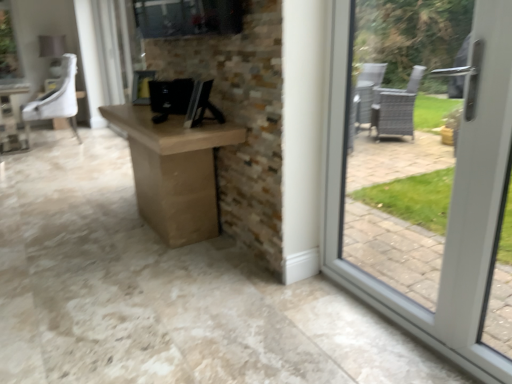
Question: Would you say black glossy desktop computer at center contains white leather chair at upper left?

Choices:
 (A) no
 (B) yes

Answer: (A)

Question: From a real-world perspective, does black glossy desktop computer at center sit lower than white leather chair at upper left?

Choices:
 (A) yes
 (B) no

Answer: (B)

Question: Is black glossy desktop computer at center behind white leather chair at upper left?

Choices:
 (A) yes
 (B) no

Answer: (B)

Question: Is black glossy desktop computer at center positioned far away from white leather chair at upper left?

Choices:
 (A) yes
 (B) no

Answer: (A)

Question: Is black glossy desktop computer at center wider than white leather chair at upper left?

Choices:
 (A) no
 (B) yes

Answer: (A)

Question: From the image's perspective, is white leather chair at upper left positioned above or below brown cardboard box at center?

Choices:
 (A) below
 (B) above

Answer: (B)

Question: Is white leather chair at upper left inside the boundaries of brown cardboard box at center, or outside?

Choices:
 (A) outside
 (B) inside

Answer: (A)

Question: Is white leather chair at upper left taller or shorter than brown cardboard box at center?

Choices:
 (A) tall
 (B) short

Answer: (A)

Question: Relative to brown cardboard box at center, is white leather chair at upper left in front or behind?

Choices:
 (A) behind
 (B) front

Answer: (A)

Question: From a real-world perspective, is black glossy desktop computer at center positioned above or below white leather chair at upper left?

Choices:
 (A) below
 (B) above

Answer: (B)

Question: Is black glossy desktop computer at center taller or shorter than white leather chair at upper left?

Choices:
 (A) short
 (B) tall

Answer: (A)

Question: In the image, is black glossy desktop computer at center positioned in front of or behind white leather chair at upper left?

Choices:
 (A) behind
 (B) front

Answer: (B)

Question: Is black glossy desktop computer at center wider or thinner than white leather chair at upper left?

Choices:
 (A) thin
 (B) wide

Answer: (A)

Question: From a real-world perspective, is brown cardboard box at center positioned above or below black glossy desktop computer at center?

Choices:
 (A) below
 (B) above

Answer: (A)

Question: Would you say brown cardboard box at center is inside or outside black glossy desktop computer at center?

Choices:
 (A) outside
 (B) inside

Answer: (A)